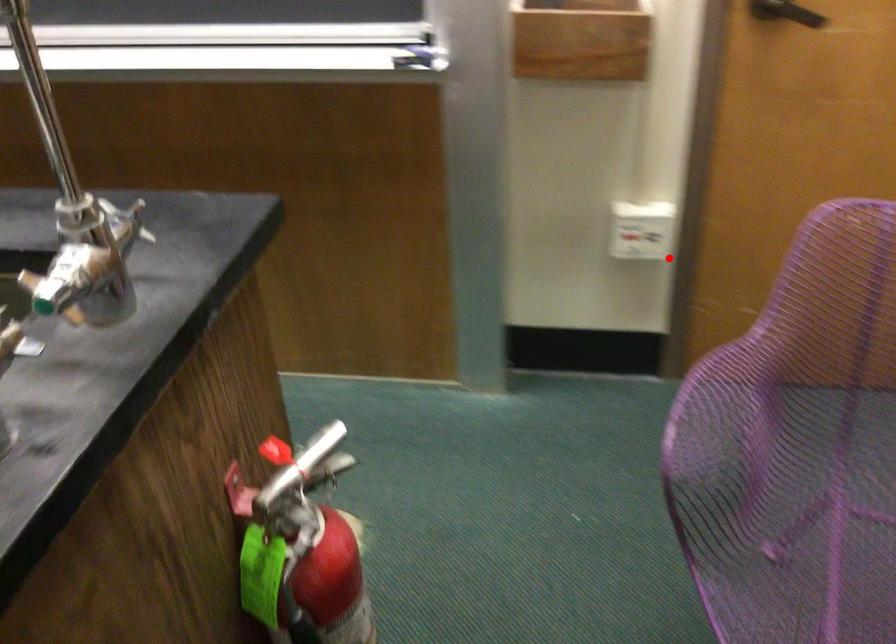
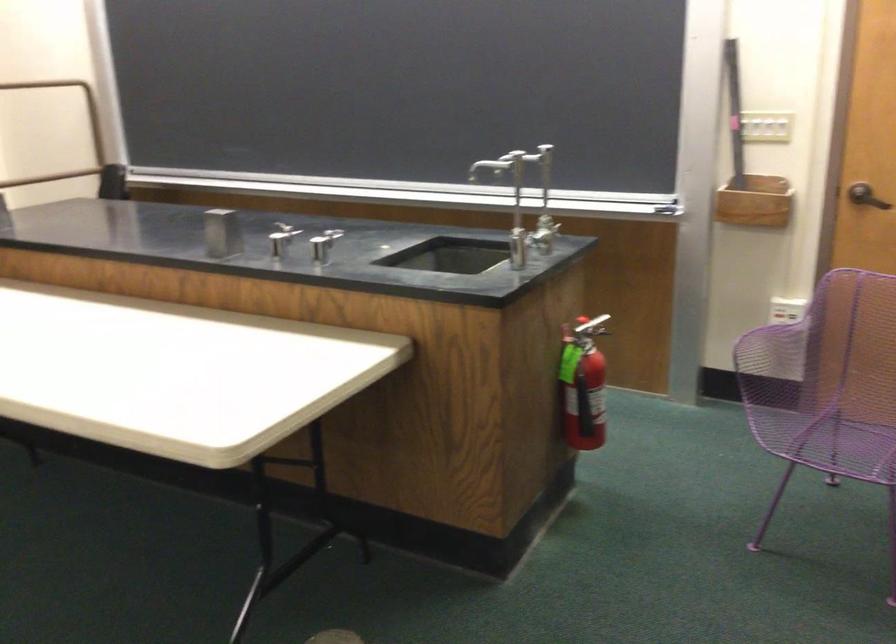
Question: I am providing you with two images of the same scene from different viewpoints. A red point is shown in image1. For the corresponding object point in image2, is it positioned nearer or farther from the camera?

Choices:
 (A) Nearer
 (B) Farther

Answer: (B)